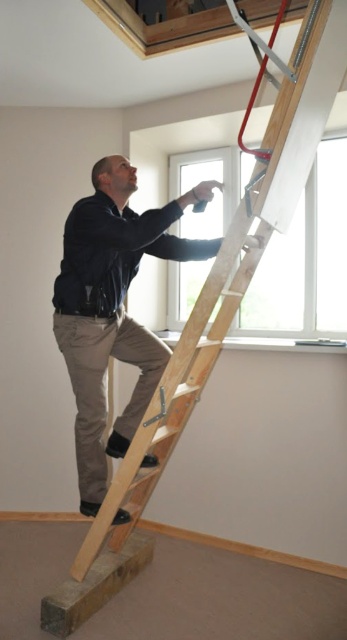
Question: Is dark brown leather jacket at upper center further to camera compared to wooden ladder at center?

Choices:
 (A) yes
 (B) no

Answer: (A)

Question: Can you confirm if dark brown leather jacket at upper center is positioned below wooden ladder at center?

Choices:
 (A) no
 (B) yes

Answer: (B)

Question: Is dark brown leather jacket at upper center positioned behind wooden ladder at center?

Choices:
 (A) no
 (B) yes

Answer: (B)